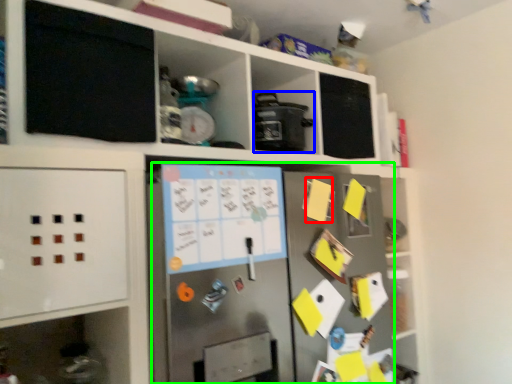
Question: Considering the real-world distances, which object is closest to note (highlighted by a red box)? appliance (highlighted by a blue box) or fridge (highlighted by a green box).

Choices:
 (A) appliance
 (B) fridge

Answer: (A)